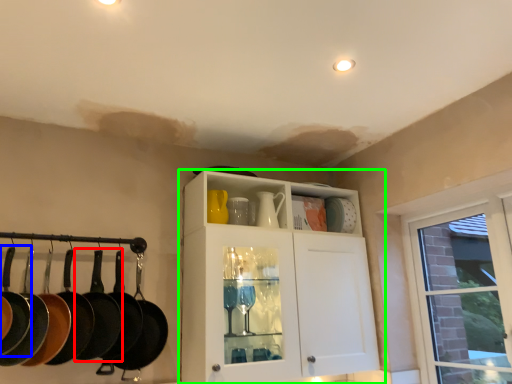
Question: Which object is the farthest from frying pan (highlighted by a red box)? Choose among these: frying pan (highlighted by a blue box) or cabinetry (highlighted by a green box).

Choices:
 (A) frying pan
 (B) cabinetry

Answer: (B)